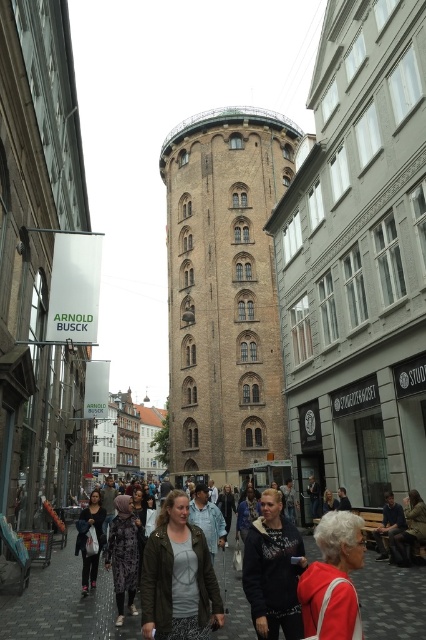
Question: Is dark gray fabric jacket at lower center positioned at the back of dark blue sweater at center?

Choices:
 (A) yes
 (B) no

Answer: (B)

Question: Which of the following is the farthest from the observer?

Choices:
 (A) (324, 548)
 (B) (92, 529)
 (C) (396, 509)
 (D) (252, 570)

Answer: (B)

Question: Which object appears farthest from the camera in this image?

Choices:
 (A) dark gray hoodie at center
 (B) dark blue sweater at center

Answer: (B)

Question: Is brown brick tower at center smaller than green textured jacket at center?

Choices:
 (A) no
 (B) yes

Answer: (A)

Question: Which object is farther from the camera taking this photo?

Choices:
 (A) green textured jacket at center
 (B) brown brick tower at center

Answer: (B)

Question: Is brown brick tower at center below green textured jacket at center?

Choices:
 (A) no
 (B) yes

Answer: (A)